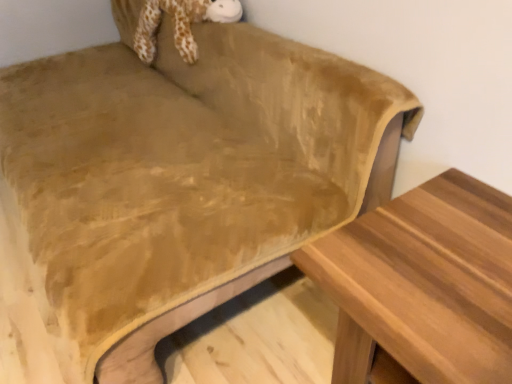
Measure the distance between light brown wood table at lower right and camera.

The depth of light brown wood table at lower right is 25.87 inches.

What do you see at coordinates (423, 283) in the screenshot? I see `light brown wood table at lower right` at bounding box center [423, 283].

Locate an element on the screen. This screenshot has height=384, width=512. light brown wood table at lower right is located at coordinates (423, 283).

Where is `light brown wood table at lower right`? light brown wood table at lower right is located at coordinates (423, 283).